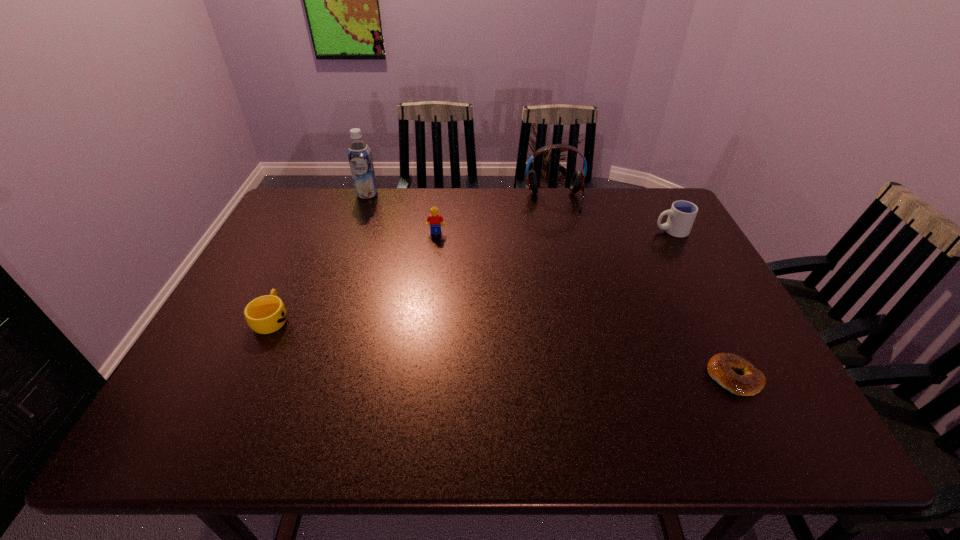
Identify the location of soya milk. The height and width of the screenshot is (540, 960). click(x=359, y=154).

Locate an element on the screen. This screenshot has width=960, height=540. the fifth object from right to left is located at coordinates (359, 154).

The height and width of the screenshot is (540, 960). Find the location of `the fifth shortest object`. the fifth shortest object is located at coordinates (577, 182).

At what (x,y) coordinates should I click in order to perform the action: click on the third object from right to left. Please return your answer as a coordinate pair (x, y). Looking at the image, I should click on (577, 182).

The height and width of the screenshot is (540, 960). In order to click on Lego in this screenshot , I will do `click(434, 220)`.

The width and height of the screenshot is (960, 540). In order to click on the right cup in this screenshot , I will do `click(682, 214)`.

Where is `the taller cup`? This screenshot has height=540, width=960. the taller cup is located at coordinates (682, 214).

Where is `the fifth tallest object`? the fifth tallest object is located at coordinates (266, 314).

Image resolution: width=960 pixels, height=540 pixels. Find the location of `the leftmost object`. the leftmost object is located at coordinates (266, 314).

Locate an element on the screen. This screenshot has width=960, height=540. the nearest object is located at coordinates point(721,367).